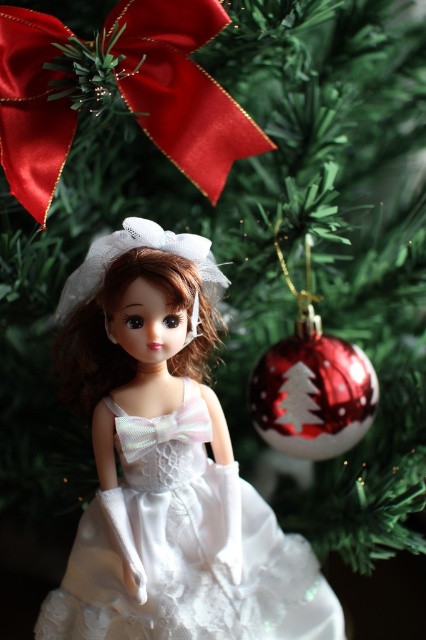
Does white satin dress at center appear under satin/red bow at upper left?

Indeed, white satin dress at center is positioned under satin/red bow at upper left.

Who is positioned more to the right, white satin dress at center or satin/red bow at upper left?

white satin dress at center is more to the right.

Between point (307, 618) and point (163, 97), which one is positioned in front?

Point (163, 97) is more forward.

You are a GUI agent. You are given a task and a screenshot of the screen. Output one action in this format:
    pyautogui.click(x=<x>, y=<y>)
    Task: Click on the white satin dress at center
    This screenshot has height=640, width=426.
    Given the screenshot: What is the action you would take?
    pyautogui.click(x=186, y=548)